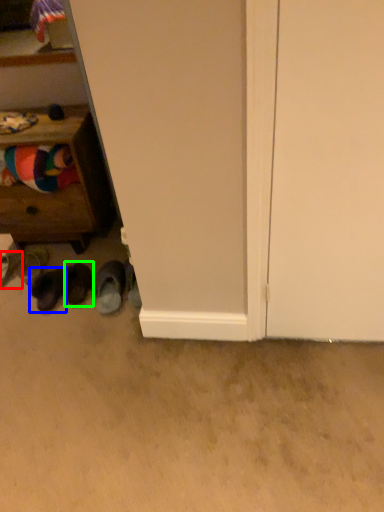
Question: Based on their relative distances, which object is farther from footwear (highlighted by a red box)? Choose from footwear (highlighted by a blue box) and footwear (highlighted by a green box).

Choices:
 (A) footwear
 (B) footwear

Answer: (B)